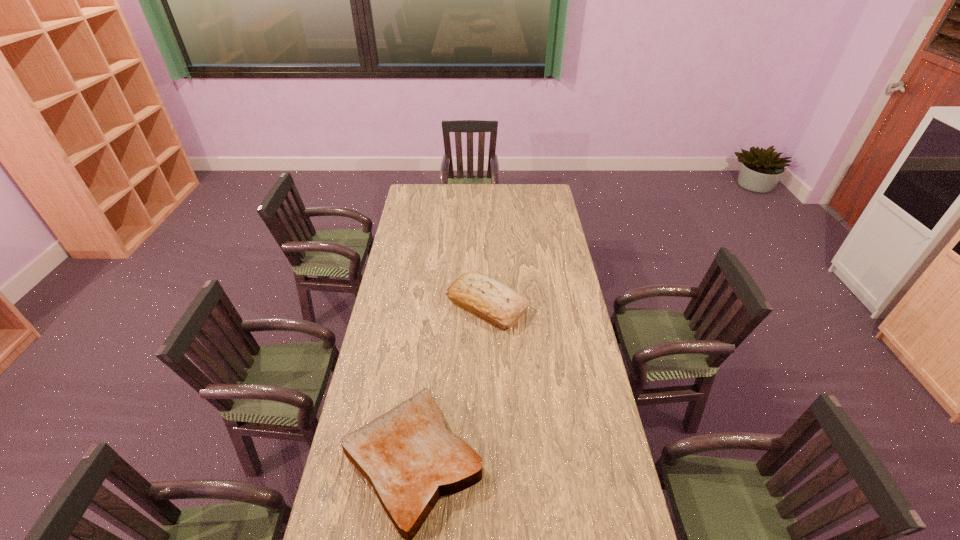
You are a GUI agent. You are given a task and a screenshot of the screen. Output one action in this format:
    pyautogui.click(x=<x>, y=<y>)
    Task: Click on the taller bread
    This screenshot has width=960, height=540.
    Given the screenshot: What is the action you would take?
    pyautogui.click(x=498, y=305)

Locate an element on the screen. The width and height of the screenshot is (960, 540). the taller object is located at coordinates pyautogui.click(x=498, y=305).

This screenshot has height=540, width=960. Find the location of `vacant space located 0.070m on the back of the taller object`. vacant space located 0.070m on the back of the taller object is located at coordinates (487, 272).

Locate an element on the screen. vacant space at the left edge of the desktop is located at coordinates (407, 234).

The height and width of the screenshot is (540, 960). In order to click on blank space at the right edge of the desktop in this screenshot , I will do `click(559, 222)`.